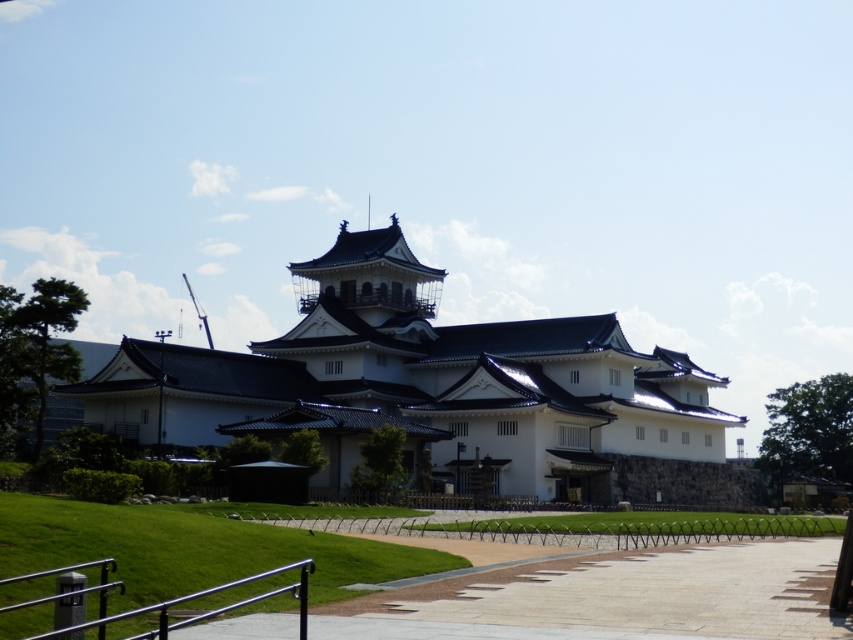
Question: Which object is closer to the camera taking this photo?

Choices:
 (A) paved concrete path at center
 (B) white matte building at center

Answer: (A)

Question: Which of the following is the closest to the observer?

Choices:
 (A) (239, 433)
 (B) (741, 547)

Answer: (B)

Question: Is white matte building at center to the right of paved concrete path at center from the viewer's perspective?

Choices:
 (A) yes
 (B) no

Answer: (B)

Question: Does white matte building at center have a greater width compared to paved concrete path at center?

Choices:
 (A) no
 (B) yes

Answer: (B)

Question: Where is white matte building at center located in relation to paved concrete path at center in the image?

Choices:
 (A) right
 (B) left

Answer: (B)

Question: Which point is farther from the camera taking this photo?

Choices:
 (A) (788, 554)
 (B) (573, 348)

Answer: (B)